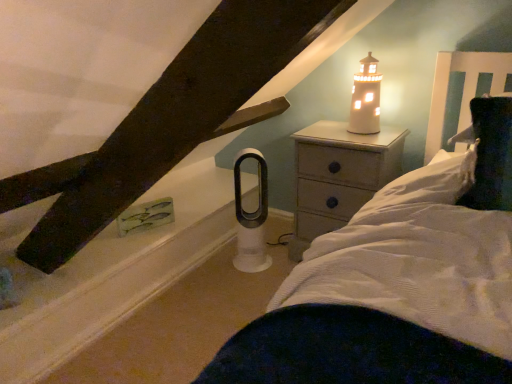
Question: Considering the relative sizes of wooden nightstand at upper right and white ceramic lighthouse at upper right in the image provided, is wooden nightstand at upper right bigger than white ceramic lighthouse at upper right?

Choices:
 (A) no
 (B) yes

Answer: (B)

Question: From a real-world perspective, is wooden nightstand at upper right physically above white ceramic lighthouse at upper right?

Choices:
 (A) yes
 (B) no

Answer: (B)

Question: Are wooden nightstand at upper right and white ceramic lighthouse at upper right far apart?

Choices:
 (A) yes
 (B) no

Answer: (B)

Question: Is wooden nightstand at upper right to the right of white ceramic lighthouse at upper right from the viewer's perspective?

Choices:
 (A) no
 (B) yes

Answer: (A)

Question: From the image's perspective, is wooden nightstand at upper right under white ceramic lighthouse at upper right?

Choices:
 (A) no
 (B) yes

Answer: (B)

Question: From the image's perspective, would you say wooden nightstand at upper right is positioned over white ceramic lighthouse at upper right?

Choices:
 (A) no
 (B) yes

Answer: (A)

Question: Is white matte window sill at lower left smaller than white ceramic lighthouse at upper right?

Choices:
 (A) yes
 (B) no

Answer: (B)

Question: From the image's perspective, would you say white matte window sill at lower left is shown under white ceramic lighthouse at upper right?

Choices:
 (A) no
 (B) yes

Answer: (B)

Question: Is white matte window sill at lower left turned away from white ceramic lighthouse at upper right?

Choices:
 (A) yes
 (B) no

Answer: (B)

Question: Is white matte window sill at lower left next to white ceramic lighthouse at upper right?

Choices:
 (A) no
 (B) yes

Answer: (A)

Question: Is white matte window sill at lower left positioned beyond the bounds of white ceramic lighthouse at upper right?

Choices:
 (A) yes
 (B) no

Answer: (A)

Question: Can you confirm if white matte window sill at lower left is thinner than white ceramic lighthouse at upper right?

Choices:
 (A) yes
 (B) no

Answer: (B)

Question: Is wooden nightstand at upper right further to the viewer compared to white matte window sill at lower left?

Choices:
 (A) yes
 (B) no

Answer: (A)